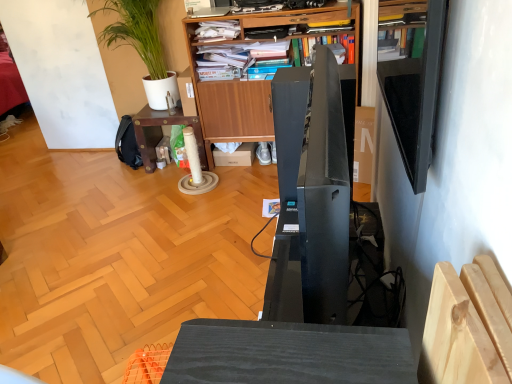
You are a GUI agent. You are given a task and a screenshot of the screen. Output one action in this format:
    pyautogui.click(x=<x>, y=<y>)
    Task: Click on the space that is in front of wooden table at center
    This screenshot has height=384, width=512.
    Given the screenshot: What is the action you would take?
    pyautogui.click(x=165, y=191)